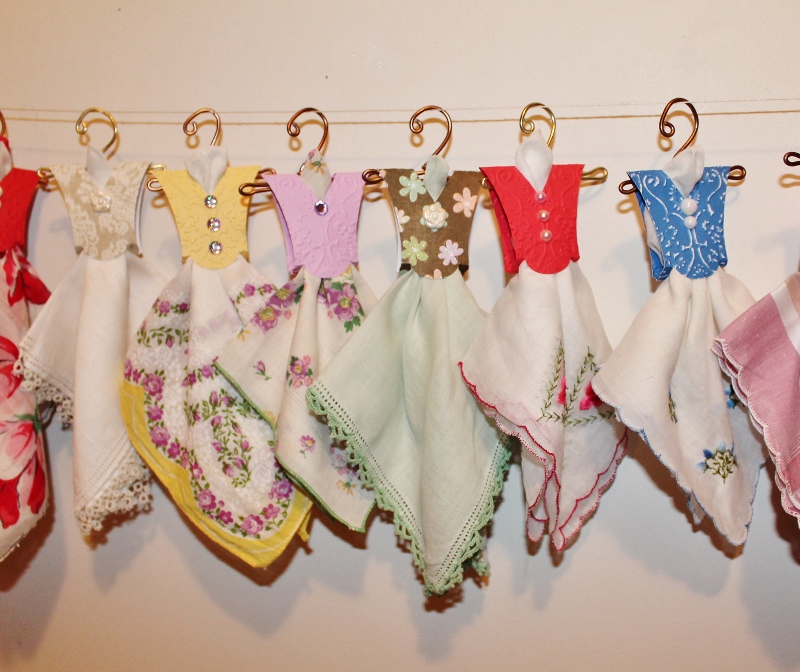
Where is `curved hangers`? Image resolution: width=800 pixels, height=672 pixels. curved hangers is located at coordinates (84, 110), (194, 114), (324, 122), (446, 126), (546, 111), (694, 114).